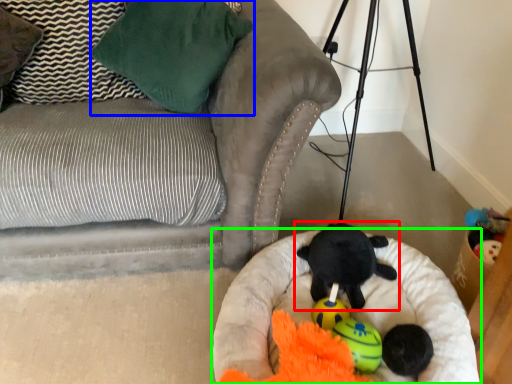
Question: Which is nearer to the toy (highlighted by a red box)? pillow (highlighted by a blue box) or dog bed (highlighted by a green box).

Choices:
 (A) pillow
 (B) dog bed

Answer: (B)